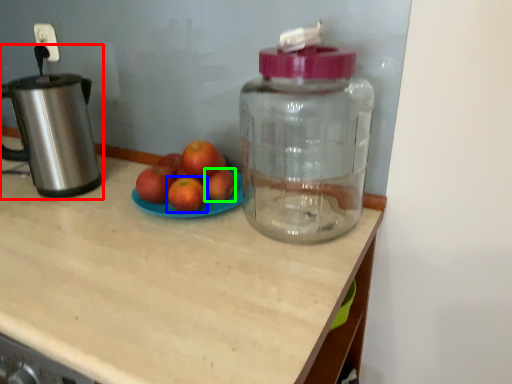
Question: Which is nearer to the kitchen appliance (highlighted by a red box)? grapefruit (highlighted by a blue box) or apple (highlighted by a green box).

Choices:
 (A) grapefruit
 (B) apple

Answer: (A)